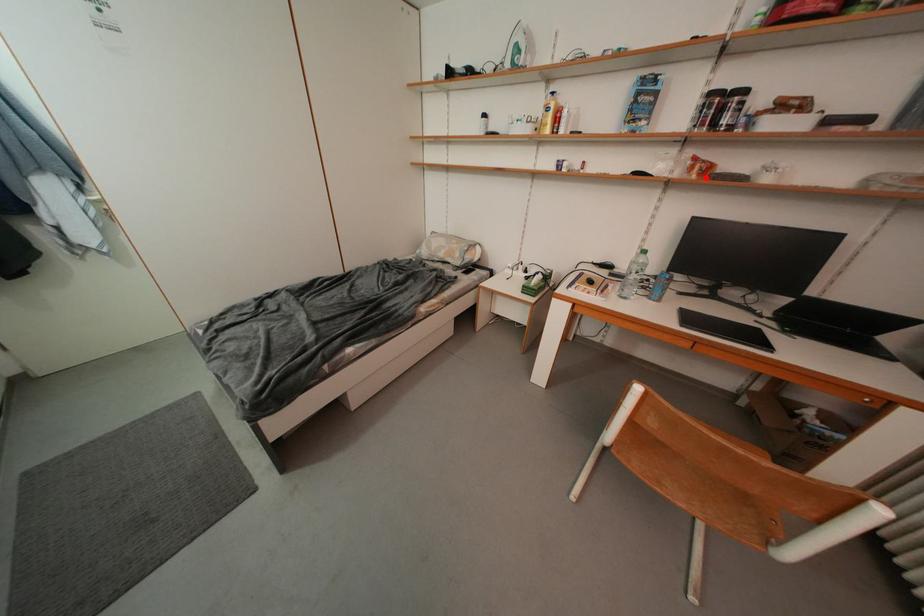
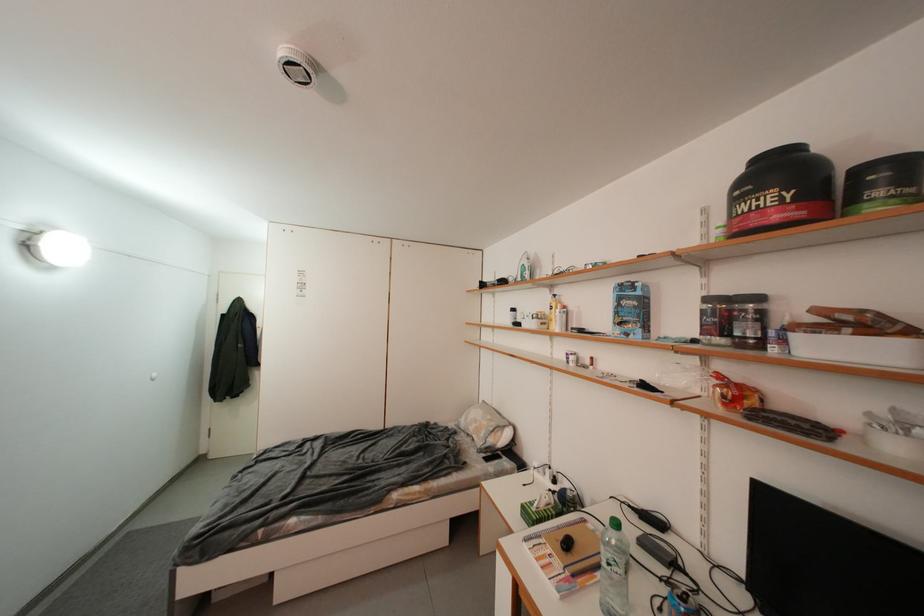
In the second image, find the point that corresponds to the highlighted location in the first image.

(733, 408)